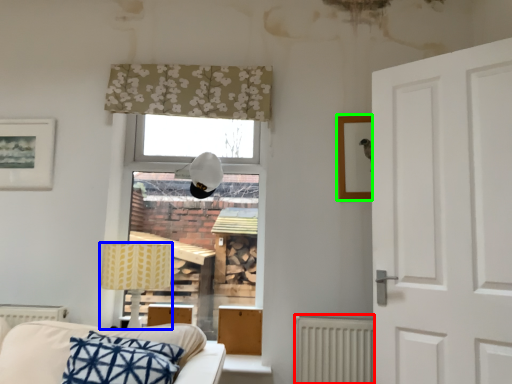
Question: Which is nearer to the radiator (highlighted by a red box)? table lamp (highlighted by a blue box) or picture frame (highlighted by a green box).

Choices:
 (A) table lamp
 (B) picture frame

Answer: (B)